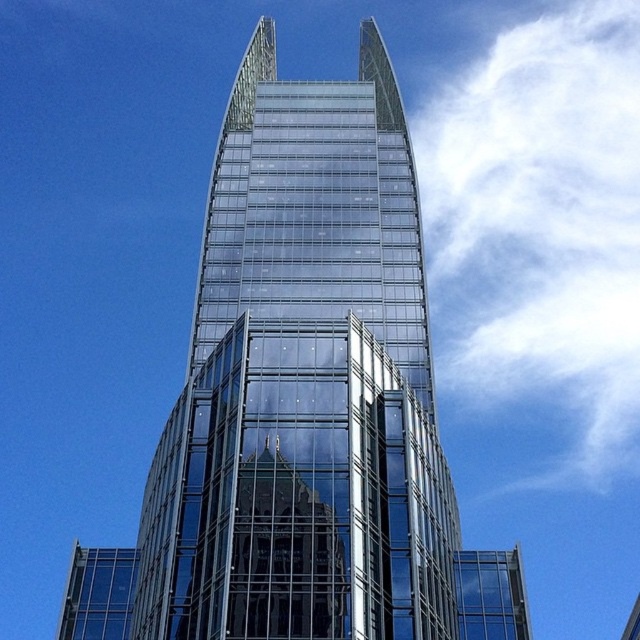
You are standing at the point marked by point [304,384] in the image. Looking around, you see the transparent glass tower at center. Which direction would you face to look directly at the transparent glass tower at center?

Since you are standing at the point marked by point [304,384], which represents the transparent glass tower at center, you are already at the location of the tower. Therefore, you cannot look directly at it from your current position.

From the picture: You are an architect analyzing the skyscraper design. From your viewpoint, is the transparent glass tower at center positioned to the left or right side of the white fluffy cloud at upper right?

The transparent glass tower at center is to the left of the white fluffy cloud at upper right according to the description.

You are a drone operator planning to fly a drone from the transparent glass tower at center to the white fluffy cloud at upper right. The drone has a maximum flight range of 600 feet. Based on the scene, will the drone be able to reach the cloud?

The transparent glass tower at center is 602.26 feet away from the white fluffy cloud at upper right. Since the drone can only fly up to 600 feet, it cannot reach the cloud.